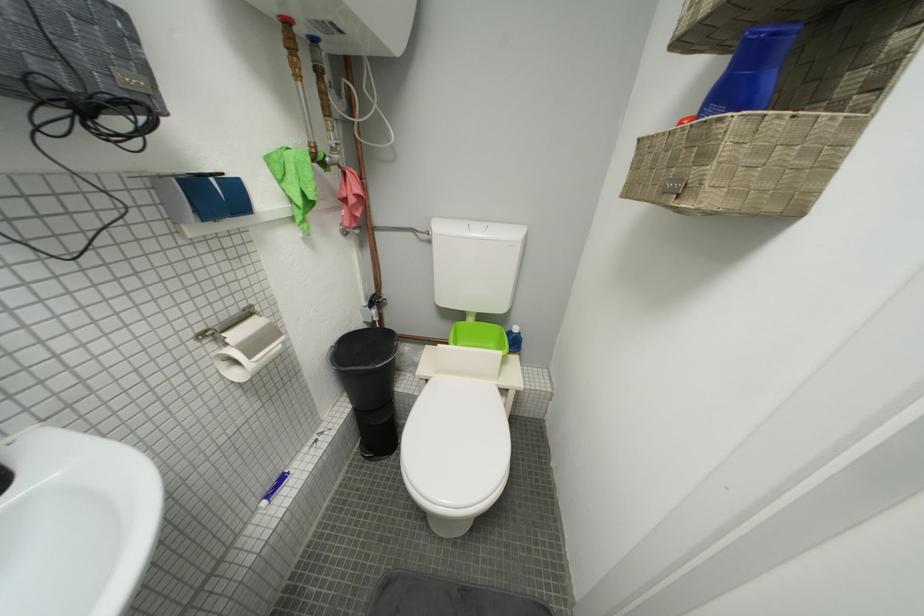
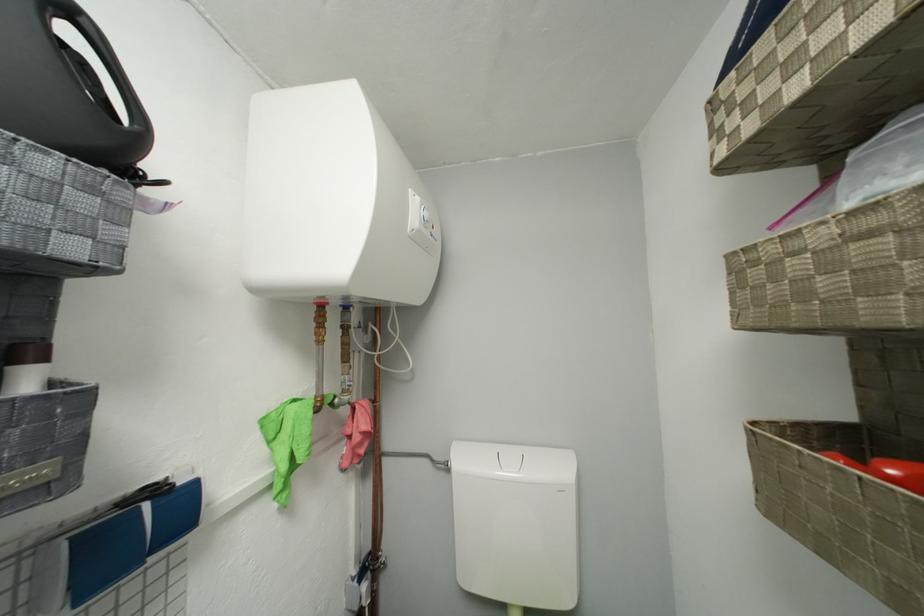
Locate, in the second image, the point that corresponds to the point at 309,204 in the first image.

(293, 469)